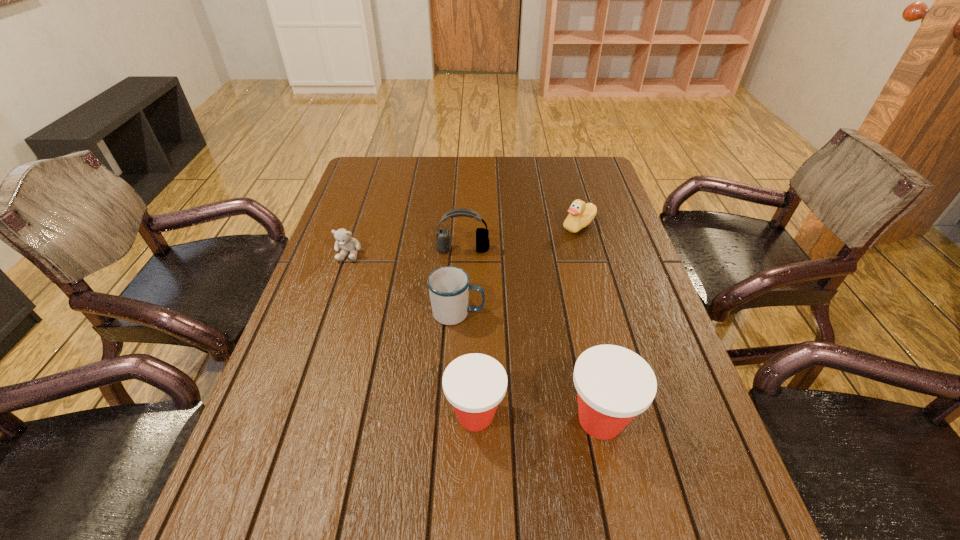
Locate an element on the screen. The width and height of the screenshot is (960, 540). free spot between the taller Dixie cup and the duck is located at coordinates (589, 323).

Where is `empty location between the headset and the farthest object`? empty location between the headset and the farthest object is located at coordinates (521, 238).

Find the location of a particular element. The image size is (960, 540). unoccupied area between the headset and the left Dixie cup is located at coordinates (469, 332).

What are the coordinates of `the third closest object to the shorter Dixie cup` in the screenshot? It's located at (442, 235).

The height and width of the screenshot is (540, 960). In order to click on object that is the fourth closest to the teddy bear in this screenshot , I will do `click(580, 215)`.

Locate an element on the screen. The image size is (960, 540). free spot that satisfies the following two spatial constraints: 1. on the handle side of the fourth farthest object; 2. on the right side of the shorter Dixie cup is located at coordinates (452, 415).

Locate an element on the screen. vacant region that satisfies the following two spatial constraints: 1. on the headband of the headset; 2. on the handle side of the mug is located at coordinates (460, 313).

Find the location of a particular element. free space that satisfies the following two spatial constraints: 1. on the headband of the taller Dixie cup; 2. on the right side of the headset is located at coordinates (455, 420).

The height and width of the screenshot is (540, 960). Find the location of `free space that satisfies the following two spatial constraints: 1. on the handle side of the mug; 2. on the left side of the shorter Dixie cup`. free space that satisfies the following two spatial constraints: 1. on the handle side of the mug; 2. on the left side of the shorter Dixie cup is located at coordinates (452, 415).

This screenshot has width=960, height=540. I want to click on free space that satisfies the following two spatial constraints: 1. on the handle side of the taller Dixie cup; 2. on the right side of the mug, so click(452, 420).